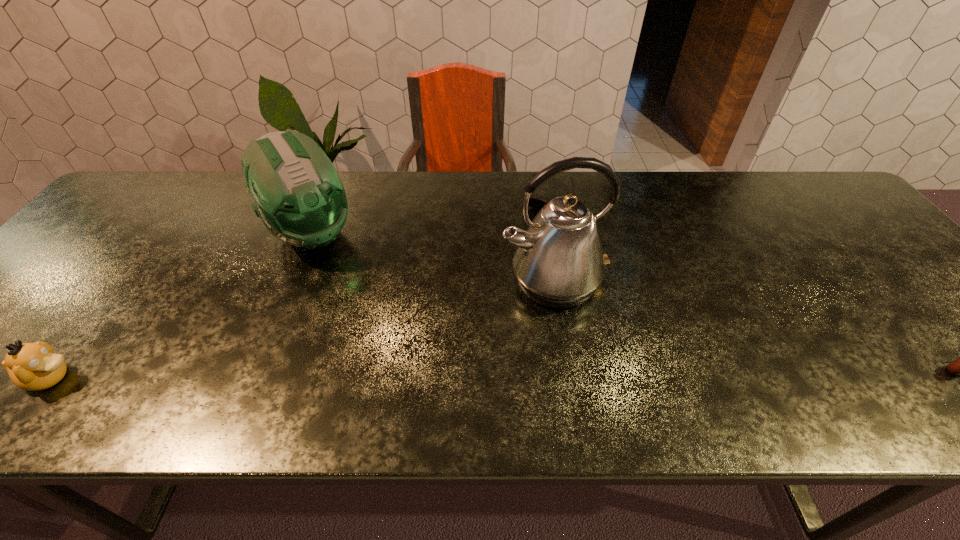
At what (x,y) coordinates should I click in order to perform the action: click on object positioned at the near left corner. Please return your answer as a coordinate pair (x, y). The height and width of the screenshot is (540, 960). Looking at the image, I should click on (31, 366).

The width and height of the screenshot is (960, 540). In order to click on free location at the far edge of the desktop in this screenshot , I will do `click(474, 175)`.

Where is `vacant space at the near edge of the desktop`? The height and width of the screenshot is (540, 960). vacant space at the near edge of the desktop is located at coordinates (913, 379).

Find the location of a particular element. The height and width of the screenshot is (540, 960). free location at the left edge of the desktop is located at coordinates (82, 252).

The image size is (960, 540). I want to click on free spot at the far right corner of the desktop, so click(x=823, y=214).

At what (x,y) coordinates should I click in order to perform the action: click on free space between the tallest object and the third tallest object. Please return your answer as a coordinate pair (x, y). Looking at the image, I should click on (x=302, y=329).

Locate an element on the screen. This screenshot has height=540, width=960. free space between the tallest object and the football helmet is located at coordinates (432, 258).

The width and height of the screenshot is (960, 540). Find the location of `free point between the second shortest object and the sunglasses`. free point between the second shortest object and the sunglasses is located at coordinates (300, 287).

I want to click on empty location between the football helmet and the tallest object, so click(432, 258).

Locate an element on the screen. This screenshot has height=540, width=960. blank region between the tallest object and the second object from left to right is located at coordinates (432, 258).